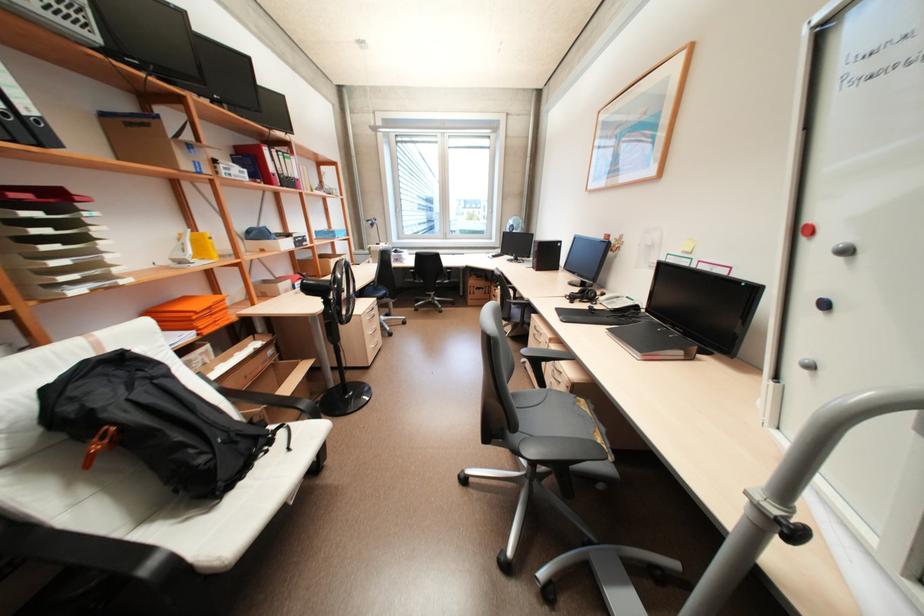
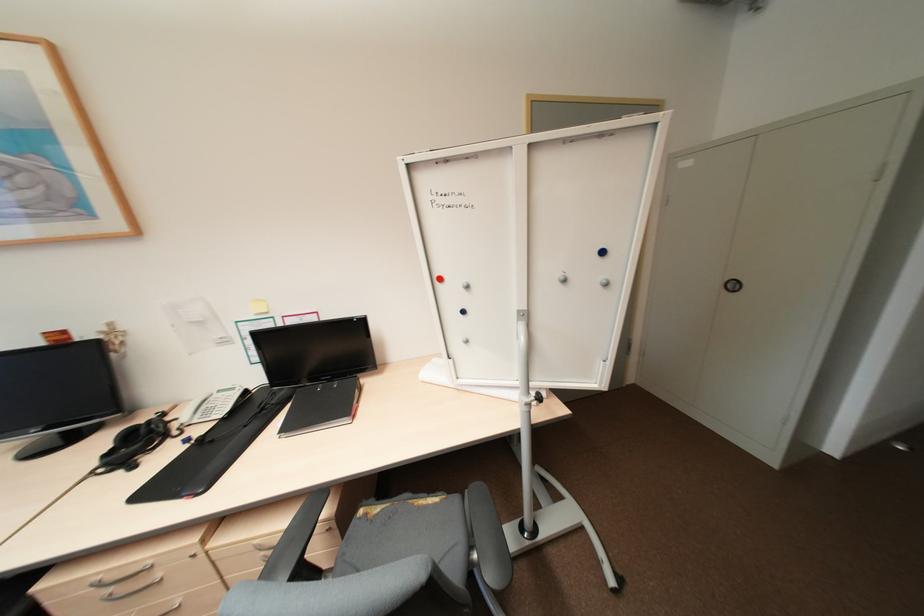
Where in the second image is the point corresponding to (541,326) from the first image?

(104, 584)